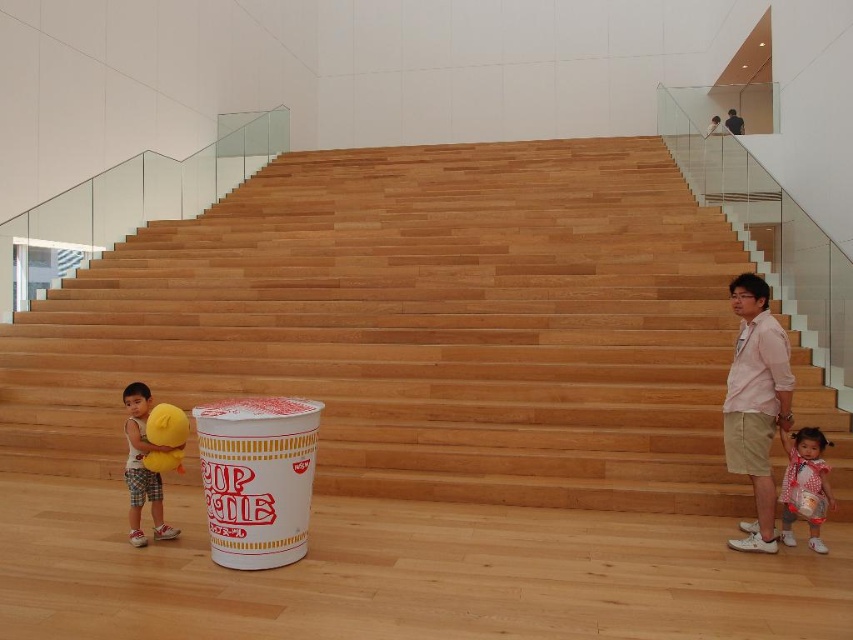
Question: Among these points, which one is nearest to the camera?

Choices:
 (A) (799, 429)
 (B) (851, 442)

Answer: (A)

Question: Among these objects, which one is nearest to the camera?

Choices:
 (A) white polka dot dress at lower right
 (B) pink cotton shirt at right
 (C) wooden stairs at center
 (D) matte yellow plush toy at lower left

Answer: (B)

Question: Based on their relative distances, which object is nearer to the matte yellow plush toy at lower left?

Choices:
 (A) pink cotton shirt at right
 (B) wooden stairs at center

Answer: (A)

Question: Can you confirm if wooden stairs at center is positioned below pink cotton shirt at right?

Choices:
 (A) no
 (B) yes

Answer: (A)

Question: Is wooden stairs at center to the right of matte yellow plush toy at lower left from the viewer's perspective?

Choices:
 (A) no
 (B) yes

Answer: (B)

Question: Can you confirm if pink cotton shirt at right is positioned below matte yellow plush toy at lower left?

Choices:
 (A) yes
 (B) no

Answer: (B)